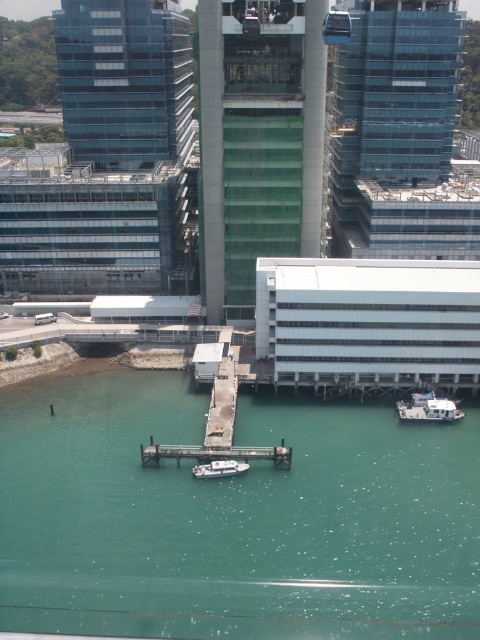
Is green water at lower center wider than smooth gray dock at center?

Yes.

Does green water at lower center have a lesser width compared to smooth gray dock at center?

Incorrect, green water at lower center's width is not less than smooth gray dock at center's.

Between point (177, 580) and point (187, 444), which one is positioned behind?

The point (187, 444) is more distant.

This screenshot has height=640, width=480. Identify the location of green water at lower center. (232, 516).

Between point (216, 426) and point (423, 410), which one is positioned in front?

Point (216, 426)

Which of these two, concrete dock at center or white matte boat at lower right, stands shorter?

white matte boat at lower right

Does point (230, 397) lie in front of point (399, 401)?

Yes, point (230, 397) is in front of point (399, 401).

The width and height of the screenshot is (480, 640). In order to click on concrete dock at center in this screenshot , I will do `click(223, 403)`.

Does green water at lower center appear on the left side of white glossy boat at center?

No, green water at lower center is not to the left of white glossy boat at center.

Is point (192, 576) closer to viewer compared to point (211, 465)?

Yes, point (192, 576) is in front of point (211, 465).

Does point (312, 435) lie behind point (229, 472)?

Yes.

Locate an element on the screen. green water at lower center is located at coordinates (232, 516).